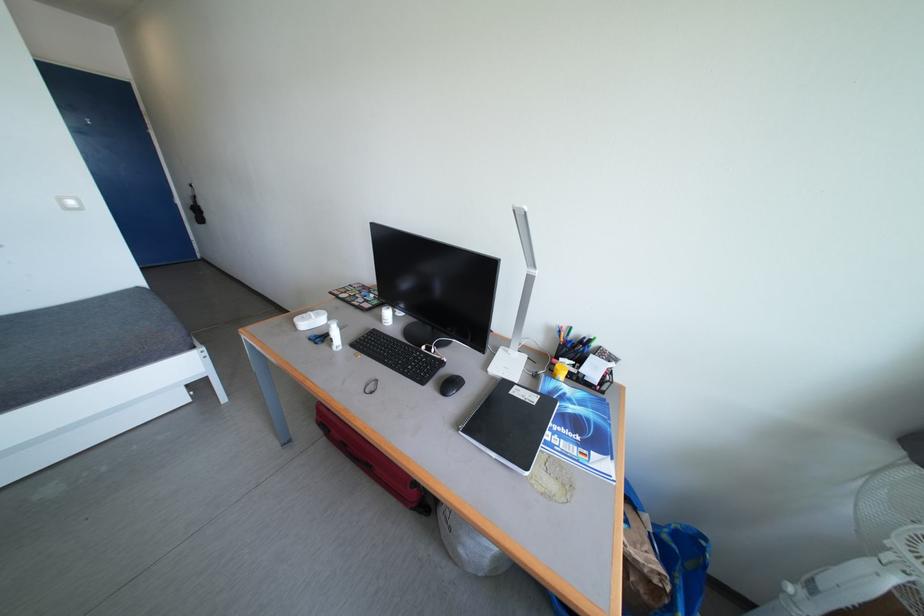
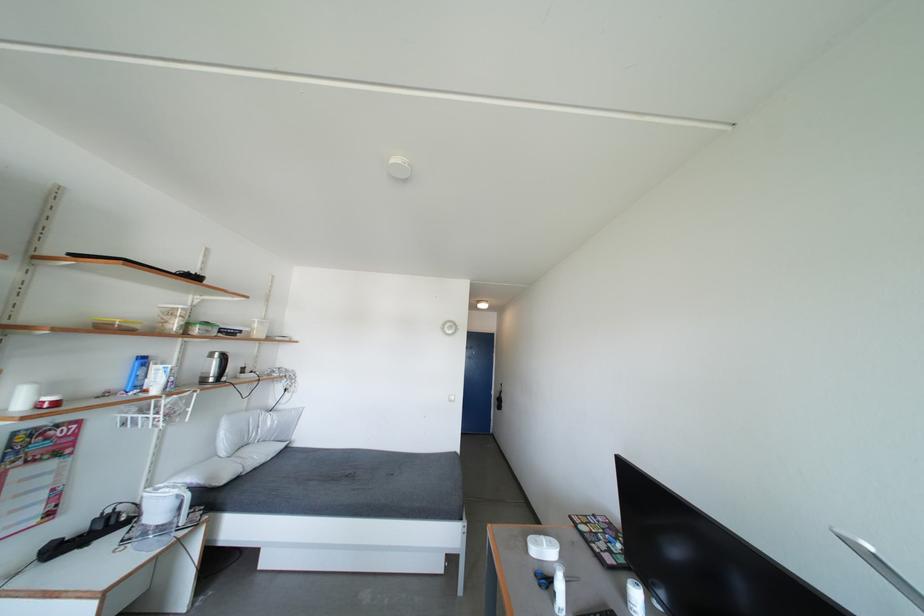
The point at (372,306) is marked in the first image. Where is the corresponding point in the second image?

(616, 556)